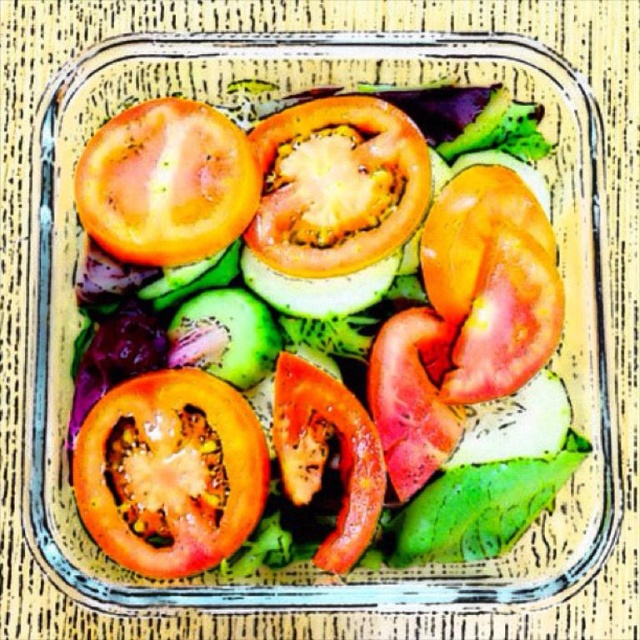
Is juicy tomato slices at center taller than juicy red tomato at upper left?

Yes.

Does juicy tomato slices at center lie in front of juicy red tomato at upper left?

Yes, it is in front of juicy red tomato at upper left.

Is point (230, 410) positioned in front of point (152, 106)?

Yes, point (230, 410) is in front of point (152, 106).

Where is `juicy tomato slices at center`? juicy tomato slices at center is located at coordinates (314, 332).

Is juicy tomato slices at center closer to the viewer compared to red matte tomato at lower left?

No, juicy tomato slices at center is further to the viewer.

Identify the location of juicy tomato slices at center. The image size is (640, 640). (314, 332).

Where is `juicy tomato slices at center`? The width and height of the screenshot is (640, 640). juicy tomato slices at center is located at coordinates (314, 332).

Who is taller, red matte tomato at lower left or juicy red tomato at upper left?

With more height is red matte tomato at lower left.

Between point (113, 515) and point (77, 196), which one is positioned behind?

The point (77, 196) is behind.

Is point (188, 554) more distant than point (170, 182)?

That is False.

Find the location of a particular element. red matte tomato at lower left is located at coordinates (x=170, y=472).